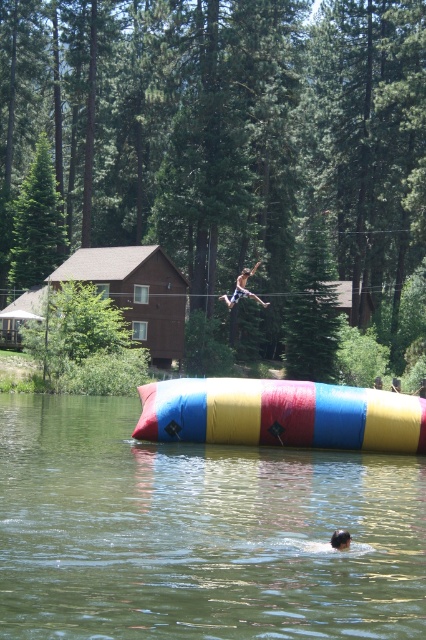
Which is behind, point (337, 557) or point (345, 532)?

Positioned behind is point (345, 532).

Describe the element at coordinates (198, 532) in the screenshot. The image size is (426, 640). I see `transparent inflatable at center` at that location.

Between point (169, 560) and point (336, 545), which one is positioned behind?

The point (336, 545) is behind.

Find the location of a particular element. This screenshot has height=640, width=426. transparent inflatable at center is located at coordinates (198, 532).

Does transparent inflatable at center appear on the right side of tan skin/striped shorts at center?

Incorrect, transparent inflatable at center is not on the right side of tan skin/striped shorts at center.

Who is positioned more to the right, transparent inflatable at center or tan skin/striped shorts at center?

From the viewer's perspective, tan skin/striped shorts at center appears more on the right side.

Between point (314, 536) and point (242, 292), which one is positioned in front?

Point (314, 536) is more forward.

The width and height of the screenshot is (426, 640). Find the location of `transparent inflatable at center`. transparent inflatable at center is located at coordinates (198, 532).

Is tan skin/striped shorts at center shorter than smooth skin person at center?

Incorrect, tan skin/striped shorts at center's height does not fall short of smooth skin person at center's.

Looking at this image, between tan skin/striped shorts at center and smooth skin person at center, which one is positioned higher?

tan skin/striped shorts at center is above.

This screenshot has width=426, height=640. Describe the element at coordinates (242, 289) in the screenshot. I see `tan skin/striped shorts at center` at that location.

Where is `tan skin/striped shorts at center`? tan skin/striped shorts at center is located at coordinates (242, 289).